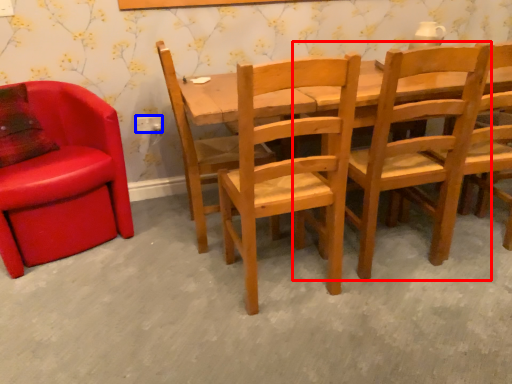
Question: Which object is further to the camera taking this photo, chair (highlighted by a red box) or power outlet (highlighted by a blue box)?

Choices:
 (A) chair
 (B) power outlet

Answer: (B)